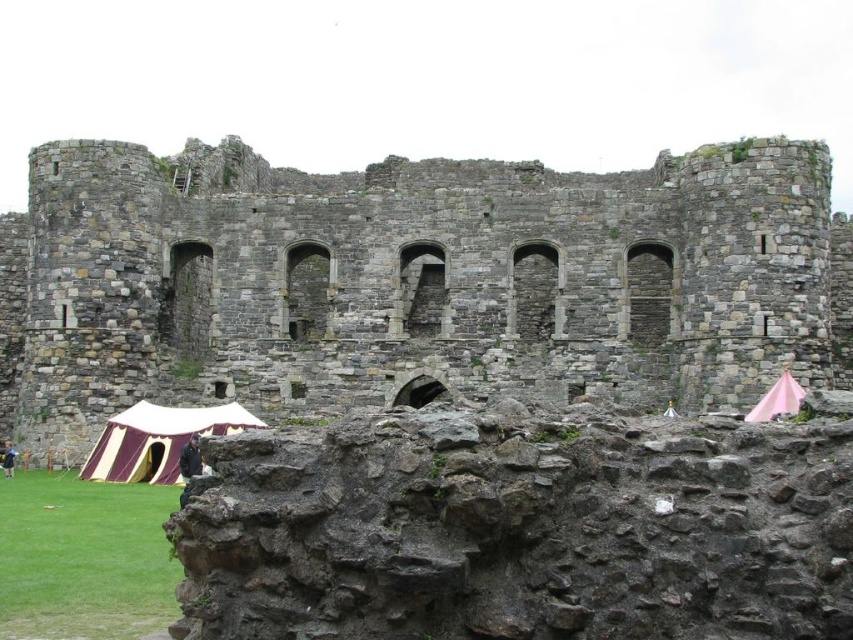
Is rusty stone castle at center below pink fabric tent at lower right?

Incorrect, rusty stone castle at center is not positioned below pink fabric tent at lower right.

In the scene shown: Is rusty stone castle at center taller than pink fabric tent at lower right?

Yes, rusty stone castle at center is taller than pink fabric tent at lower right.

Does point (827, 173) come in front of point (773, 394)?

That is False.

Find the location of a particular element. Image resolution: width=853 pixels, height=640 pixels. rusty stone castle at center is located at coordinates (412, 280).

Who is positioned more to the left, maroon canvas tent at lower left or pink fabric tent at lower right?

maroon canvas tent at lower left is more to the left.

Which is above, maroon canvas tent at lower left or pink fabric tent at lower right?

pink fabric tent at lower right is above.

Locate an element on the screen. maroon canvas tent at lower left is located at coordinates [x=157, y=440].

Does rusty stone castle at center have a lesser width compared to maroon canvas tent at lower left?

Incorrect, rusty stone castle at center's width is not less than maroon canvas tent at lower left's.

Who is positioned more to the right, rusty stone castle at center or maroon canvas tent at lower left?

rusty stone castle at center is more to the right.

Does point (18, 316) come in front of point (173, 476)?

No, (18, 316) is behind (173, 476).

Identify the location of rusty stone castle at center. [412, 280].